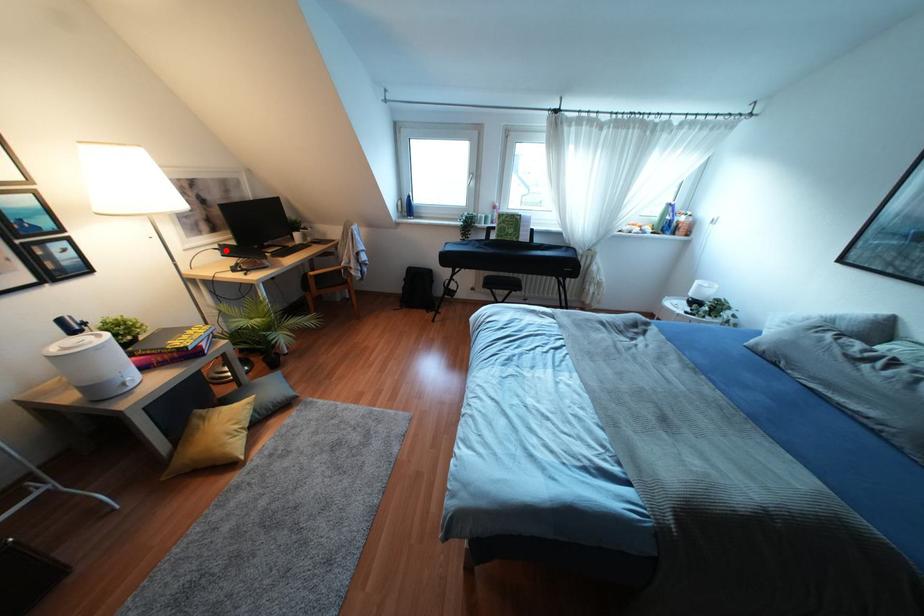
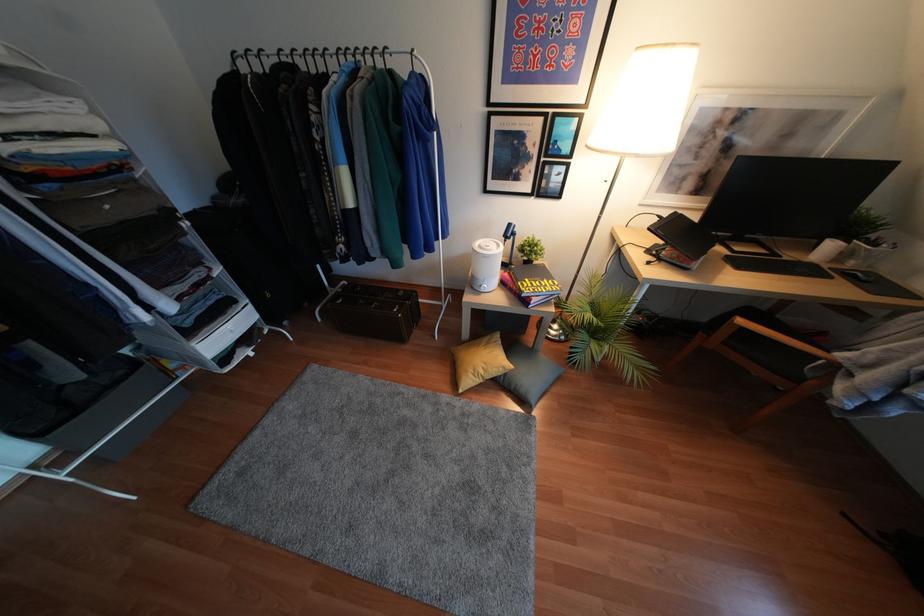
Question: I am providing you with two images of the same scene from different viewpoints. In image1, a red point is highlighted. Considering the same 3D point in image2, which of the following is correct?

Choices:
 (A) It is closer
 (B) It is farther

Answer: (B)